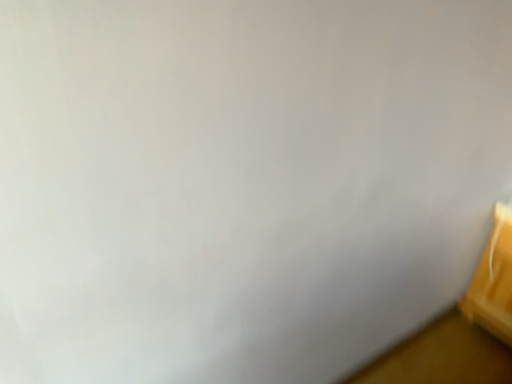
Locate an element on the screen. Image resolution: width=512 pixels, height=384 pixels. wooden table at lower right is located at coordinates (493, 280).

Describe the element at coordinates (493, 280) in the screenshot. I see `wooden table at lower right` at that location.

This screenshot has width=512, height=384. Find the location of `wooden table at lower right`. wooden table at lower right is located at coordinates (493, 280).